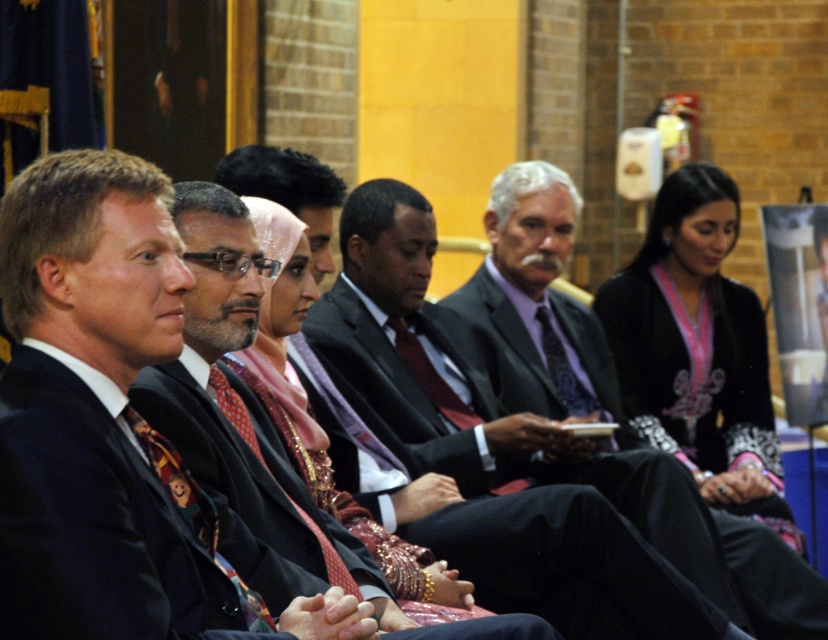
Based on the photo, can you confirm if purple satin suit at center is taller than matte black suit at center?

Yes.

Between purple satin suit at center and matte black suit at center, which one is positioned lower?

purple satin suit at center is below.

Between point (551, 209) and point (310, 502), which one is positioned behind?

Positioned behind is point (551, 209).

The image size is (828, 640). Find the location of `purple satin suit at center`. purple satin suit at center is located at coordinates (607, 403).

Looking at this image, is black satin suit at center wider than dark gray suit at center?

Yes, black satin suit at center is wider than dark gray suit at center.

Which is behind, point (37, 557) or point (612, 627)?

The point (612, 627) is more distant.

Who is more forward, (31, 499) or (554, 548)?

Positioned in front is point (31, 499).

I want to click on black satin suit at center, so click(94, 524).

Can you confirm if black satin suit at center is wider than purple satin suit at center?

No.

Is black satin suit at center smaller than purple satin suit at center?

Correct, black satin suit at center occupies less space than purple satin suit at center.

From the picture: Who is more forward, (27, 428) or (697, 509)?

Point (27, 428) is in front.

Identify the location of black satin suit at center. Image resolution: width=828 pixels, height=640 pixels. (94, 524).